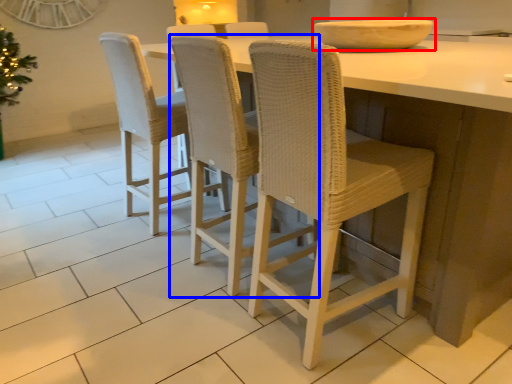
Question: Which object is closer to the camera taking this photo, bowl (highlighted by a red box) or chair (highlighted by a blue box)?

Choices:
 (A) bowl
 (B) chair

Answer: (B)